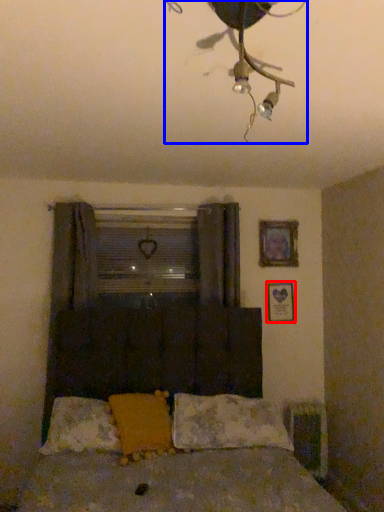
Question: Which object is closer to the camera taking this photo, picture frame (highlighted by a red box) or lamp (highlighted by a blue box)?

Choices:
 (A) picture frame
 (B) lamp

Answer: (B)